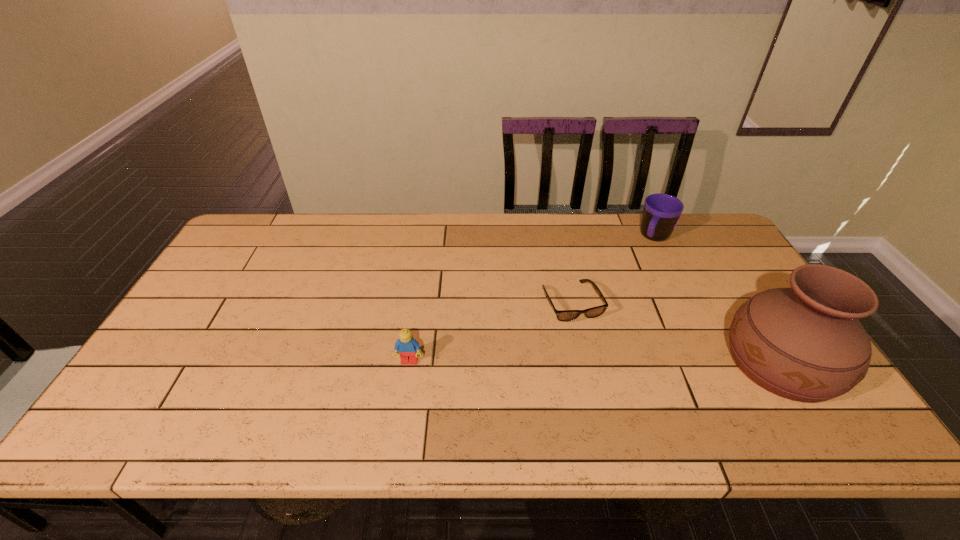
Locate an element on the screen. This screenshot has height=540, width=960. Lego is located at coordinates (408, 348).

You are a GUI agent. You are given a task and a screenshot of the screen. Output one action in this format:
    pyautogui.click(x=<x>, y=<y>)
    Task: Click on the urn
    This screenshot has width=960, height=540.
    Given the screenshot: What is the action you would take?
    pos(805,343)

Locate an element on the screen. This screenshot has height=540, width=960. mug is located at coordinates (661, 213).

Image resolution: width=960 pixels, height=540 pixels. I want to click on the shortest object, so click(562, 315).

Identify the location of the third object from right to left. The image size is (960, 540). (562, 315).

Identify the location of free space located on the back of the urn. The width and height of the screenshot is (960, 540). (729, 280).

In order to click on free spot located with the handle on the side of the mug in this screenshot , I will do `click(620, 298)`.

You are a GUI agent. You are given a task and a screenshot of the screen. Output one action in this format:
    pyautogui.click(x=<x>, y=<y>)
    Task: Click on the vacant region located with the handle on the side of the mug
    Image resolution: width=960 pixels, height=540 pixels.
    Given the screenshot: What is the action you would take?
    pyautogui.click(x=640, y=266)

Find the location of a particular element. vacant space located 0.350m with the handle on the side of the mug is located at coordinates (611, 315).

Where is `free space located 0.230m on the lenses of the spectacles`? This screenshot has height=540, width=960. free space located 0.230m on the lenses of the spectacles is located at coordinates (617, 400).